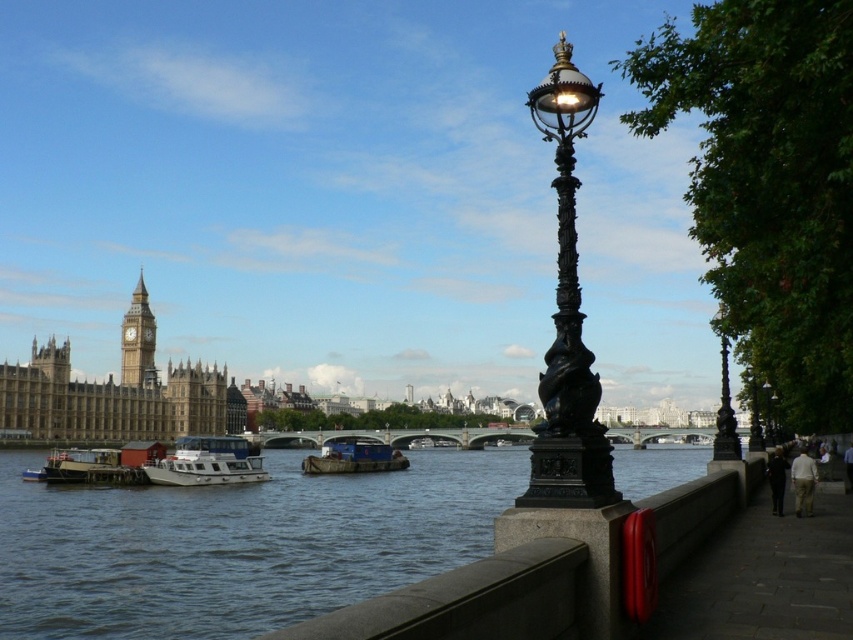
Question: Which of these objects is positioned closest to the stone clock tower at upper left?

Choices:
 (A) blue water at center
 (B) white matte boat at lower left
 (C) black wrought iron street light at center

Answer: (B)

Question: Can you confirm if black wrought iron street light at center is positioned above white matte boat at lower left?

Choices:
 (A) yes
 (B) no

Answer: (A)

Question: Among these points, which one is farthest from the camera?

Choices:
 (A) (212, 451)
 (B) (401, 458)
 (C) (140, 296)

Answer: (C)

Question: Is black wrought iron street light at center further to camera compared to stone clock tower at upper left?

Choices:
 (A) no
 (B) yes

Answer: (A)

Question: Estimate the real-world distances between objects in this image. Which object is farther from the white matte boat at lower left?

Choices:
 (A) stone clock tower at upper left
 (B) blue water at center

Answer: (A)

Question: Can you confirm if stone clock tower at upper left is positioned to the left of blue matte barge at center?

Choices:
 (A) no
 (B) yes

Answer: (B)